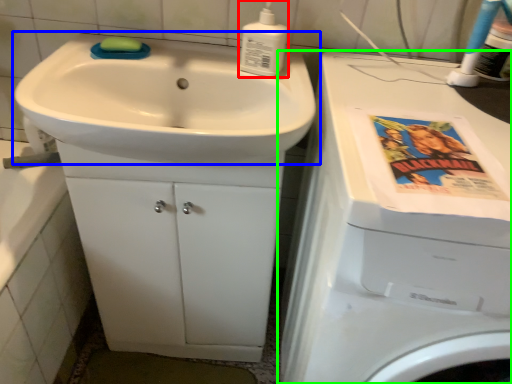
Question: Which object is the farthest from soap dispenser (highlighted by a red box)? Choose among these: sink (highlighted by a blue box) or washing machine (highlighted by a green box).

Choices:
 (A) sink
 (B) washing machine

Answer: (B)